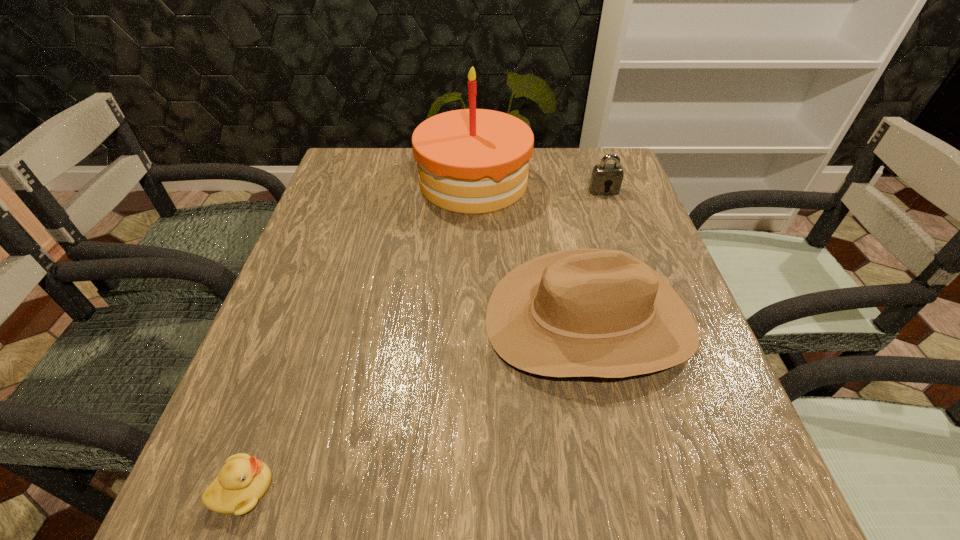
Locate an element on the screen. the tallest object is located at coordinates (472, 161).

Find the location of a particular element. The height and width of the screenshot is (540, 960). the third farthest object is located at coordinates (581, 312).

Identify the location of the third shortest object. (581, 312).

Locate an element on the screen. This screenshot has width=960, height=540. the second shortest object is located at coordinates (605, 177).

Identify the location of duckling. This screenshot has width=960, height=540. (243, 480).

This screenshot has width=960, height=540. What are the coordinates of `the leftmost object` in the screenshot? It's located at (243, 480).

Where is `free space located on the right of the tallest object`? Image resolution: width=960 pixels, height=540 pixels. free space located on the right of the tallest object is located at coordinates (556, 182).

You are a GUI agent. You are given a task and a screenshot of the screen. Output one action in this format:
    pyautogui.click(x=<x>, y=<y>)
    Task: Click on the vacant space located on the back of the third shortest object
    The height and width of the screenshot is (540, 960).
    Given the screenshot: What is the action you would take?
    pyautogui.click(x=567, y=224)

Find the location of a particular element. vacant space located at the front of the second shortest object near the keyhole is located at coordinates (645, 310).

This screenshot has height=540, width=960. Find the location of `free space located 0.370m on the beak of the duckling`. free space located 0.370m on the beak of the duckling is located at coordinates (530, 489).